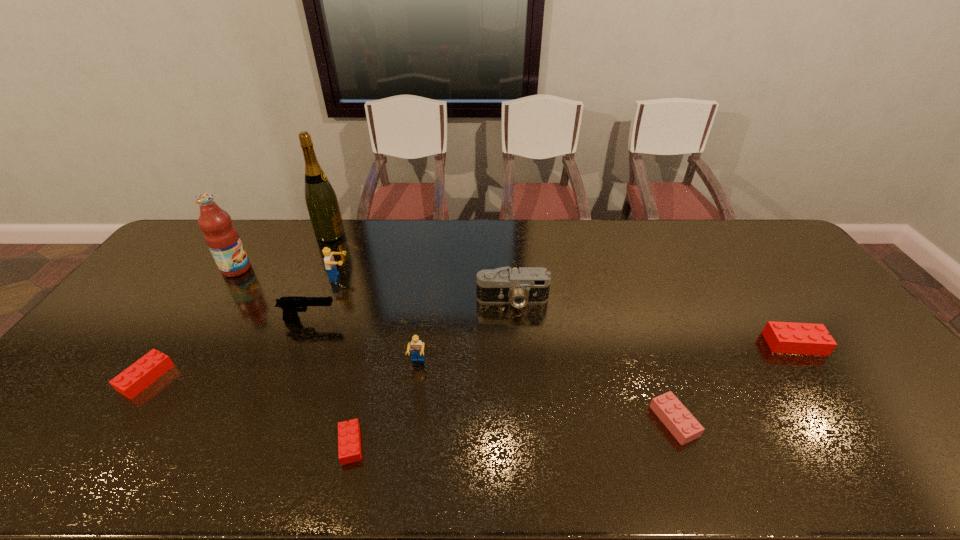
Identify the location of vacant position located 0.180m on the front label of the ninth shortest object. click(303, 269).

Identify the location of free space located on the face of the farthest Lego. (421, 277).

You are a GUI agent. You are given a task and a screenshot of the screen. Output one action in this format:
    pyautogui.click(x=<x>, y=<y>)
    Task: Click on the vacant space located 0.320m on the lens of the camera
    This screenshot has height=540, width=960.
    Given the screenshot: What is the action you would take?
    pyautogui.click(x=521, y=403)

The image size is (960, 540). I want to click on blank space located on the front-facing side of the black pistol, so click(415, 320).

Find the location of `free space located on the face of the fourth object from right to left`. free space located on the face of the fourth object from right to left is located at coordinates (414, 388).

I want to click on free point located 0.210m on the back of the rightmost red Lego, so click(x=753, y=284).

You are a GUI agent. You are given a task and a screenshot of the screen. Output one action in this format:
    pyautogui.click(x=<x>, y=<y>)
    Task: Click on the vacant area situated 0.070m on the left of the second biggest red Lego
    Image resolution: width=960 pixels, height=540 pixels.
    Given the screenshot: What is the action you would take?
    pyautogui.click(x=99, y=377)

Where is `free space located on the left of the second object from right to left`? The image size is (960, 540). free space located on the left of the second object from right to left is located at coordinates (566, 421).

I want to click on vacant space situated on the right of the second red Lego from left to right, so click(x=478, y=444).

I want to click on object present at the far edge, so click(321, 201).